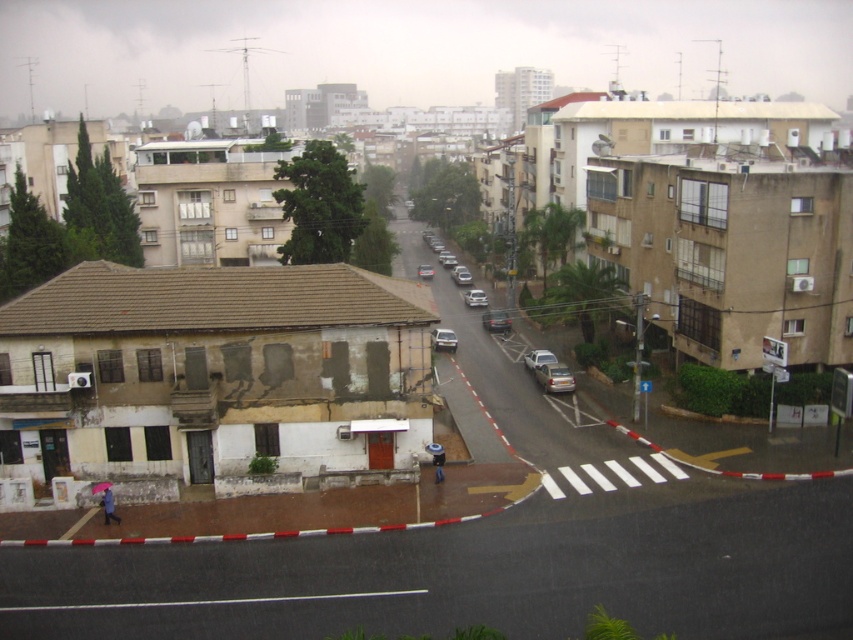
Question: Which object is positioned farthest from the shiny silver sedan at center?

Choices:
 (A) silver metallic sedan at center
 (B) matte silver sedan at center
 (C) raincoat fabric umbrella at lower left

Answer: (C)

Question: Is silver metallic sedan at center-right below silver metallic car at center-right?

Choices:
 (A) yes
 (B) no

Answer: (A)

Question: In this image, where is satin silver sedan at center located relative to matte silver sedan at center?

Choices:
 (A) right
 (B) left

Answer: (A)

Question: Does shiny silver sedan at center appear on the right side of matte silver sedan at center?

Choices:
 (A) yes
 (B) no

Answer: (A)

Question: Which of the following is the closest to the observer?

Choices:
 (A) silver metallic car at center-right
 (B) matte silver sedan at center

Answer: (A)

Question: Among these points, which one is nearest to the camera?

Choices:
 (A) (490, 330)
 (B) (434, 333)
 (C) (543, 355)

Answer: (C)